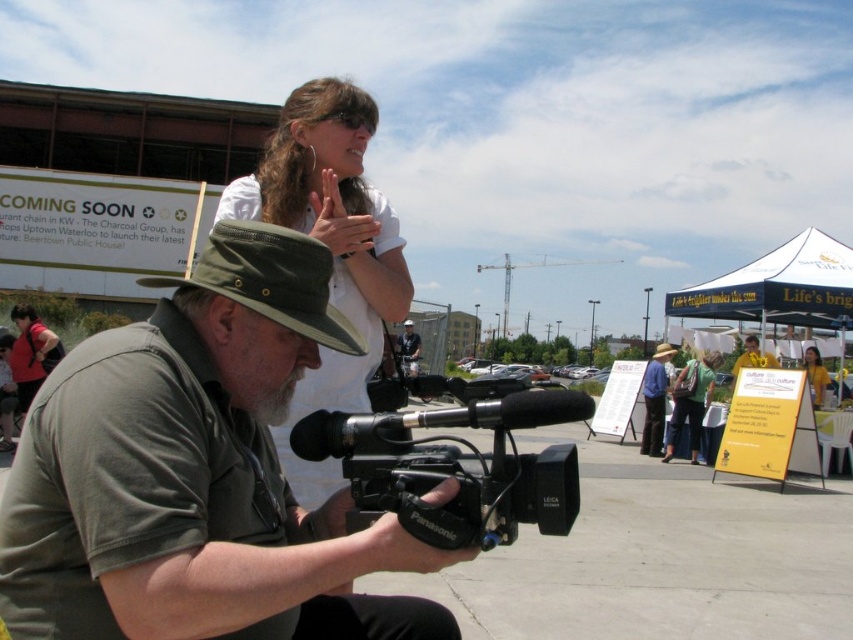
The width and height of the screenshot is (853, 640). Describe the element at coordinates (329, 248) in the screenshot. I see `white matte shirt at upper center` at that location.

Is point (341, 376) positioned in front of point (816, 353)?

Yes, point (341, 376) is in front of point (816, 353).

The height and width of the screenshot is (640, 853). I want to click on white matte shirt at upper center, so click(329, 248).

Is white matte shirt at upper center shorter than matte red shirt at lower left?

No.

Is white matte shirt at upper center positioned behind matte red shirt at lower left?

No.

Where is `white matte shirt at upper center`? white matte shirt at upper center is located at coordinates (329, 248).

I want to click on white matte shirt at upper center, so click(x=329, y=248).

Does green canvas hat at center appear over yellow fabric shirt at center?

Correct, green canvas hat at center is located above yellow fabric shirt at center.

Who is more forward, [236,316] or [804,365]?

Point [236,316] is more forward.

At what (x,y) coordinates should I click in order to perform the action: click on green canvas hat at center. Please return your answer as a coordinate pair (x, y). Looking at the image, I should click on (196, 474).